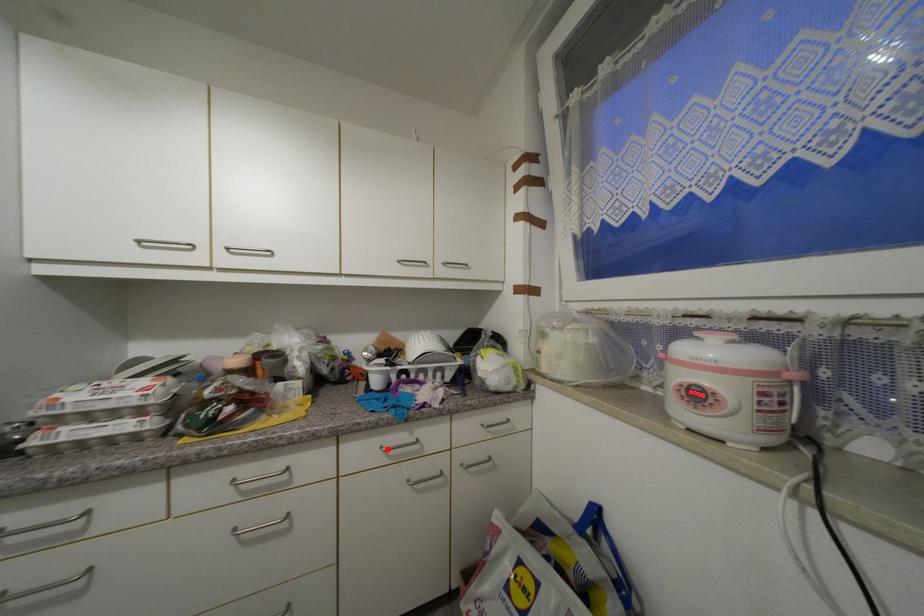
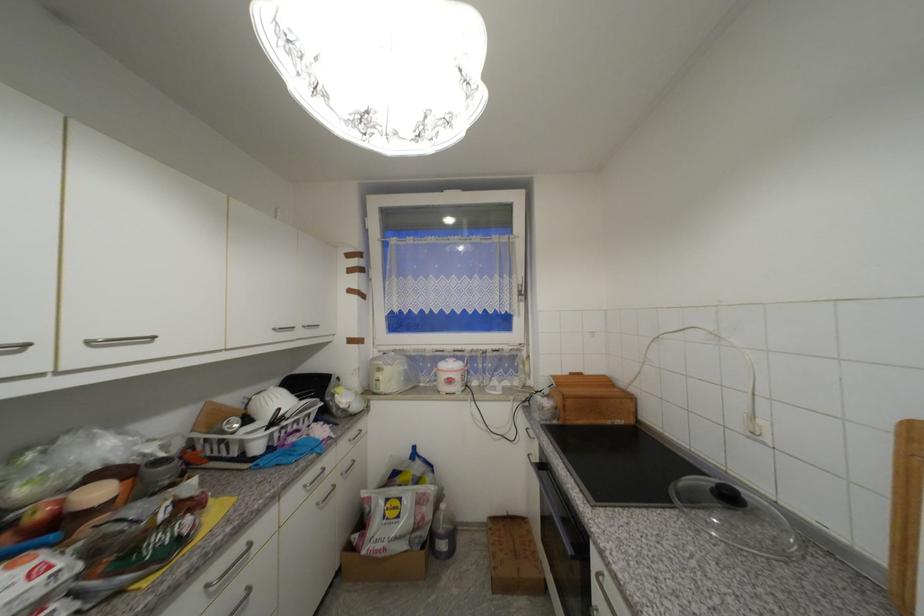
Question: I am providing you with two images of the same scene from different viewpoints. In image1, a red point is highlighted. Considering the same 3D point in image2, which of the following is correct?

Choices:
 (A) It is closer
 (B) It is farther

Answer: (A)